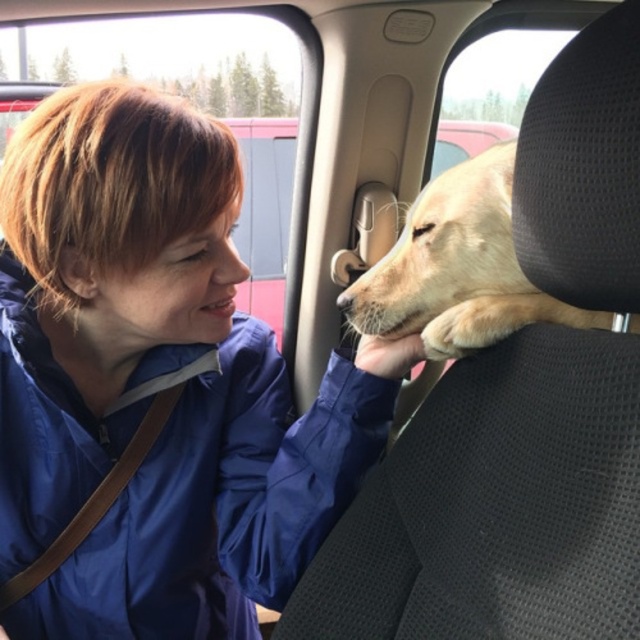
Question: Does transparent glass window at upper center lie behind golden fur dog at center?

Choices:
 (A) yes
 (B) no

Answer: (A)

Question: Can you confirm if transparent glass window at upper center is wider than golden fur dog at center?

Choices:
 (A) yes
 (B) no

Answer: (A)

Question: Does transparent glass window at upper center appear over golden fur dog at center?

Choices:
 (A) yes
 (B) no

Answer: (A)